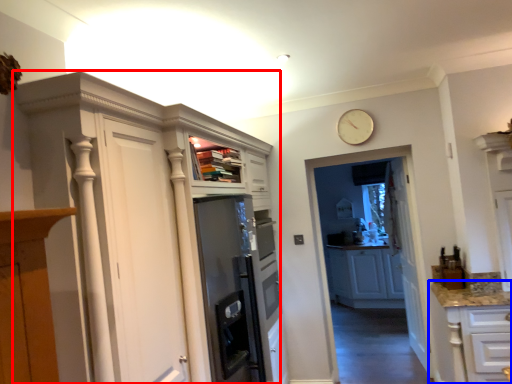
Question: Which object is closer to the camera taking this photo, cupboard (highlighted by a red box) or cabinetry (highlighted by a blue box)?

Choices:
 (A) cupboard
 (B) cabinetry

Answer: (A)